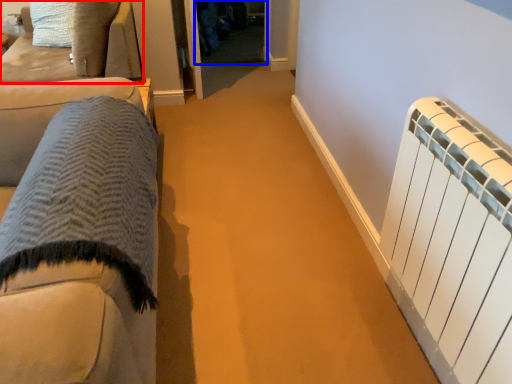
Question: Which of the following is the closest to the observer, furniture (highlighted by a red box) or glass door (highlighted by a blue box)?

Choices:
 (A) furniture
 (B) glass door

Answer: (A)